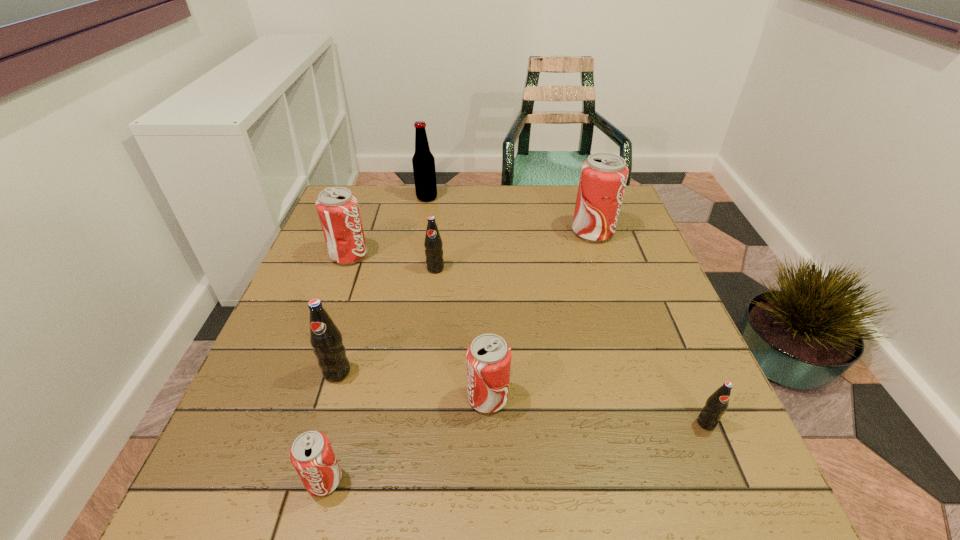
Where is `vacant region at the near left corner of the desktop`? This screenshot has width=960, height=540. vacant region at the near left corner of the desktop is located at coordinates (254, 507).

The image size is (960, 540). What are the coordinates of `vacant space at the near right corner of the desktop` in the screenshot? It's located at (706, 509).

Identify the location of blank region between the biggest black pop and the second object from right to left. (465, 302).

This screenshot has width=960, height=540. Find the location of `vacant space that is in between the second pink soda can from left to right and the farthest object`. vacant space that is in between the second pink soda can from left to right and the farthest object is located at coordinates (375, 339).

Identify the location of free spot between the leftmost black pop and the third pink soda can from right to left. (330, 426).

This screenshot has width=960, height=540. In order to click on vacant space in between the second black pop from right to left and the leftmost pink soda can in this screenshot , I will do `click(393, 262)`.

Where is `free space between the beer bottle and the seventh object from left to right`? The height and width of the screenshot is (540, 960). free space between the beer bottle and the seventh object from left to right is located at coordinates [510, 215].

Find the location of a particular element. This screenshot has width=960, height=540. free point between the rightmost soda can and the second object from right to left is located at coordinates (649, 328).

Find the location of `free space between the leftmost black pop and the fourth soda can from left to right`. free space between the leftmost black pop and the fourth soda can from left to right is located at coordinates (386, 321).

The height and width of the screenshot is (540, 960). What are the coordinates of `vacant space in between the third pink soda can from right to left and the biggest black pop` in the screenshot? It's located at (330, 426).